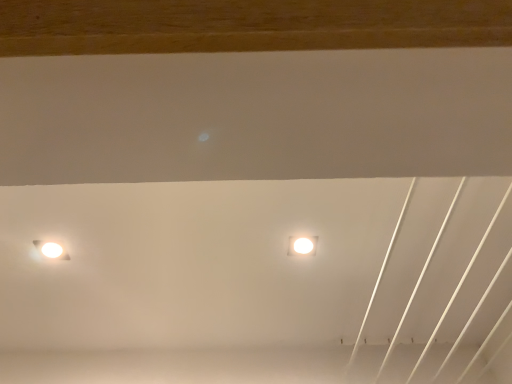
Question: In the image, is white glossy lamp at left, marked as the 2th lamp in a right-to-left arrangement, positioned in front of or behind white glossy lamp at upper center, placed as the 2th lamp when sorted from left to right?

Choices:
 (A) behind
 (B) front

Answer: (B)

Question: Considering the positions of white glossy lamp at left, marked as the 2th lamp in a right-to-left arrangement, and white glossy lamp at upper center, the 1th lamp in the right-to-left sequence, in the image, is white glossy lamp at left, marked as the 2th lamp in a right-to-left arrangement, wider or thinner than white glossy lamp at upper center, the 1th lamp in the right-to-left sequence,?

Choices:
 (A) thin
 (B) wide

Answer: (A)

Question: From their relative heights in the image, would you say white glossy lamp at left, which is the first lamp from left to right, is taller or shorter than white glossy lamp at upper center, placed as the 2th lamp when sorted from left to right?

Choices:
 (A) tall
 (B) short

Answer: (A)

Question: From a real-world perspective, relative to white glossy lamp at left, marked as the 2th lamp in a right-to-left arrangement, is white glossy lamp at upper center, the 1th lamp in the right-to-left sequence, vertically above or below?

Choices:
 (A) below
 (B) above

Answer: (A)

Question: Visually, is white glossy lamp at upper center, the 1th lamp in the right-to-left sequence, positioned to the left or to the right of white glossy lamp at left, which is the first lamp from left to right?

Choices:
 (A) left
 (B) right

Answer: (B)

Question: From the image's perspective, is white glossy lamp at upper center, placed as the 2th lamp when sorted from left to right, located above or below white glossy lamp at left, marked as the 2th lamp in a right-to-left arrangement?

Choices:
 (A) above
 (B) below

Answer: (A)

Question: Considering the positions of white glossy lamp at upper center, the 1th lamp in the right-to-left sequence, and white glossy lamp at left, marked as the 2th lamp in a right-to-left arrangement, in the image, is white glossy lamp at upper center, the 1th lamp in the right-to-left sequence, wider or thinner than white glossy lamp at left, marked as the 2th lamp in a right-to-left arrangement,?

Choices:
 (A) thin
 (B) wide

Answer: (B)